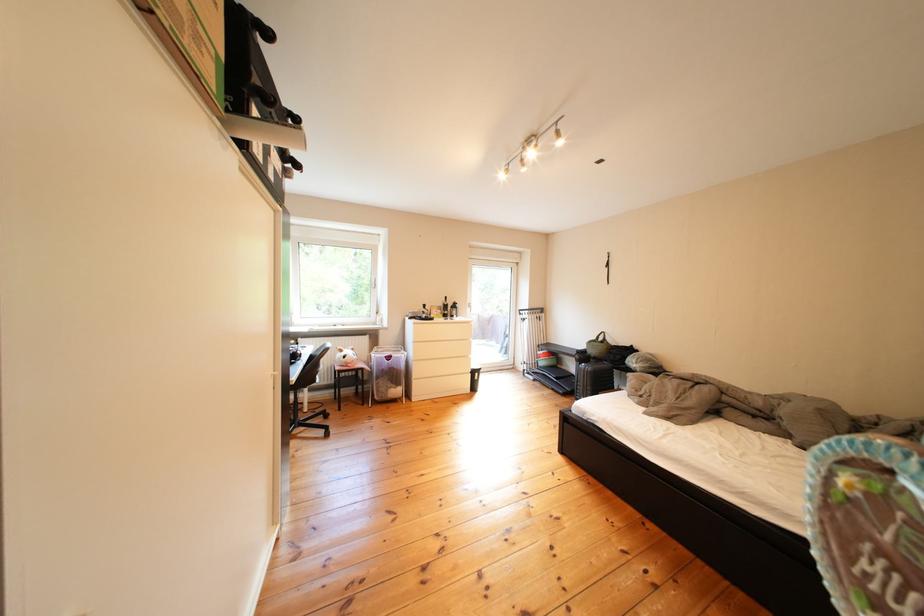
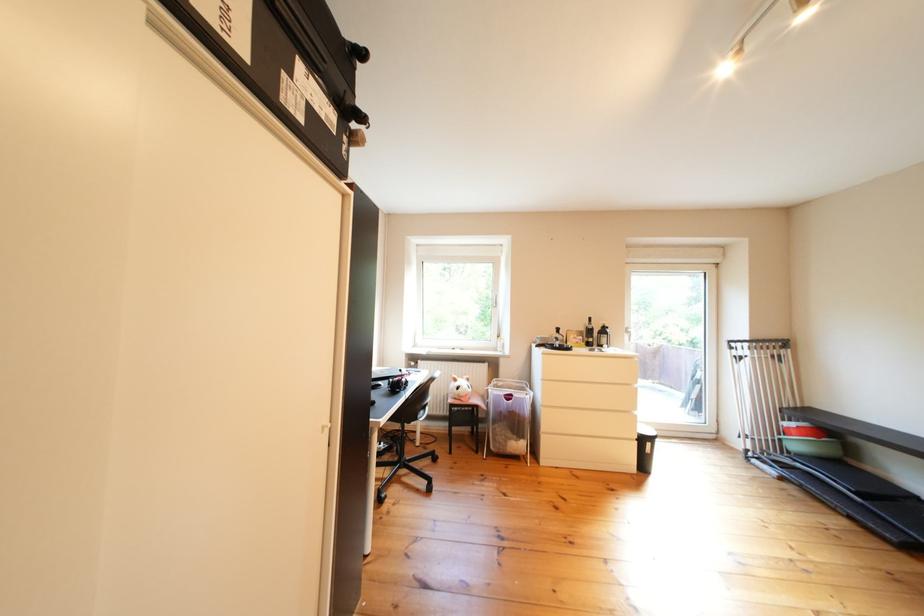
Question: How did the camera likely rotate?

Choices:
 (A) Left
 (B) Right
 (C) Up
 (D) Down

Answer: (A)